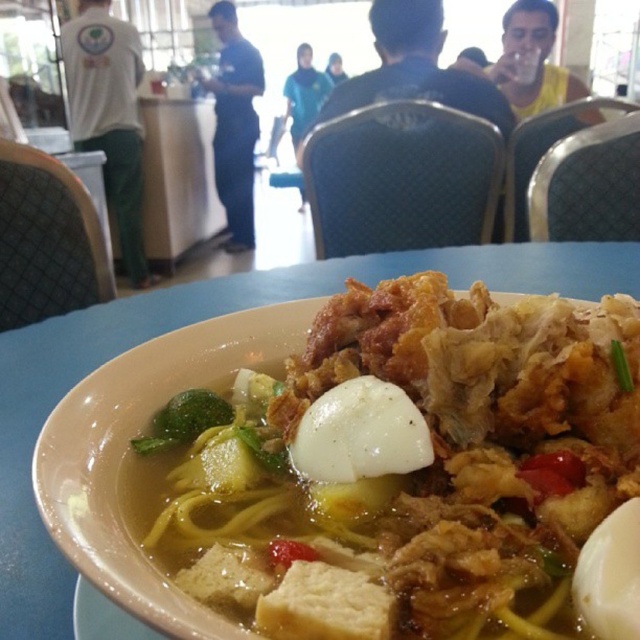
Does translucent white egg at center have a smaller size compared to green leafy vegetable at center?

No, translucent white egg at center is not smaller than green leafy vegetable at center.

Is the position of translucent white egg at center more distant than that of green leafy vegetable at center?

No, it is not.

Which is behind, point (513, 593) or point (172, 416)?

The point (172, 416) is more distant.

This screenshot has height=640, width=640. In order to click on translucent white egg at center in this screenshot , I will do `click(416, 468)`.

Does translucent white egg at center have a greater width compared to white matte egg at center?

Yes, translucent white egg at center is wider than white matte egg at center.

Based on the photo, can you confirm if translucent white egg at center is positioned below white matte egg at center?

No.

Which is behind, point (294, 390) or point (605, 580)?

The point (294, 390) is more distant.

In order to click on translucent white egg at center in this screenshot , I will do `click(416, 468)`.

Which is above, translucent white egg at center or white smooth egg at center?

translucent white egg at center

From the picture: Does translucent white egg at center have a smaller size compared to white smooth egg at center?

No, translucent white egg at center is not smaller than white smooth egg at center.

Which is behind, point (449, 604) or point (376, 472)?

The point (376, 472) is more distant.

Find the location of a particular element. The image size is (640, 640). translucent white egg at center is located at coordinates (416, 468).